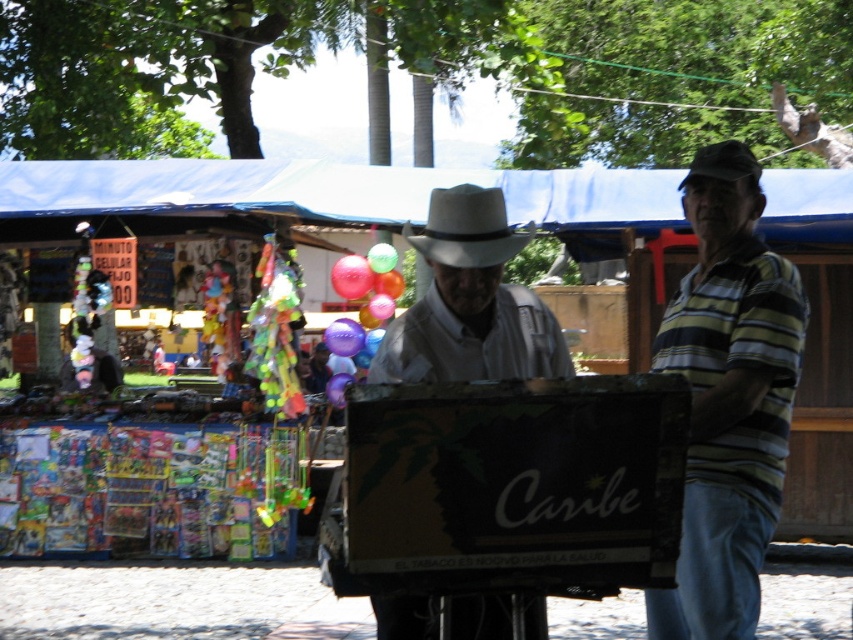
Measure the distance from gray felt fedora at center to purple glossy balloon at center.

gray felt fedora at center and purple glossy balloon at center are 5.73 meters apart.

Can you confirm if gray felt fedora at center is thinner than purple glossy balloon at center?

No, gray felt fedora at center is not thinner than purple glossy balloon at center.

Which is behind, point (418, 250) or point (346, 353)?

Point (346, 353)

Find the location of a particular element. gray felt fedora at center is located at coordinates [x=467, y=228].

What do you see at coordinates (723, 163) in the screenshot? I see `black felt fedora at center` at bounding box center [723, 163].

Is point (714, 173) positioned before point (343, 262)?

Yes.

Which is behind, point (746, 170) or point (344, 282)?

The point (344, 282) is behind.

Identify the location of black felt fedora at center. (723, 163).

Between striped cotton shirt at center and gray felt fedora at center, which one appears on the right side from the viewer's perspective?

From the viewer's perspective, striped cotton shirt at center appears more on the right side.

This screenshot has height=640, width=853. Identify the location of striped cotton shirt at center. [728, 397].